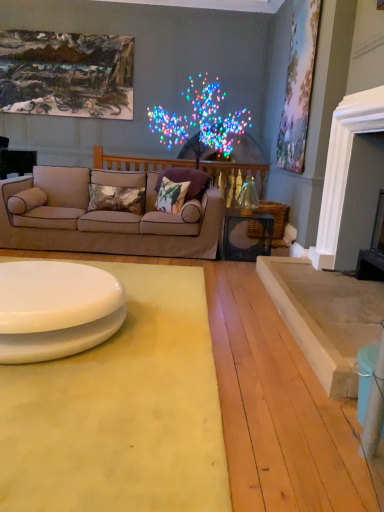
What are the coordinates of `vacant area that is situated to the right of white glossy table at lower left, the 1th table viewed from the left` in the screenshot? It's located at (157, 344).